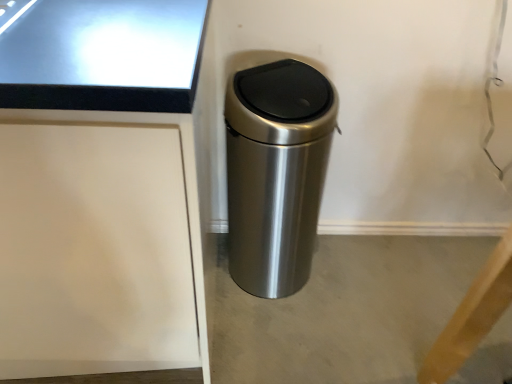
Question: In terms of height, does gray concrete at center look taller or shorter compared to satin silver trash can at center?

Choices:
 (A) tall
 (B) short

Answer: (B)

Question: Is gray concrete at center wider or thinner than satin silver trash can at center?

Choices:
 (A) wide
 (B) thin

Answer: (A)

Question: Looking at the image, does gray concrete at center seem bigger or smaller compared to satin silver trash can at center?

Choices:
 (A) big
 (B) small

Answer: (B)

Question: In terms of size, does satin silver trash can at center appear bigger or smaller than gray concrete at center?

Choices:
 (A) small
 (B) big

Answer: (B)

Question: Does point [x=281, y=221] appear closer or farther from the camera than point [x=353, y=344]?

Choices:
 (A) closer
 (B) farther

Answer: (A)

Question: From a real-world perspective, relative to gray concrete at center, is satin silver trash can at center vertically above or below?

Choices:
 (A) below
 (B) above

Answer: (B)

Question: Is satin silver trash can at center situated inside gray concrete at center or outside?

Choices:
 (A) outside
 (B) inside

Answer: (A)